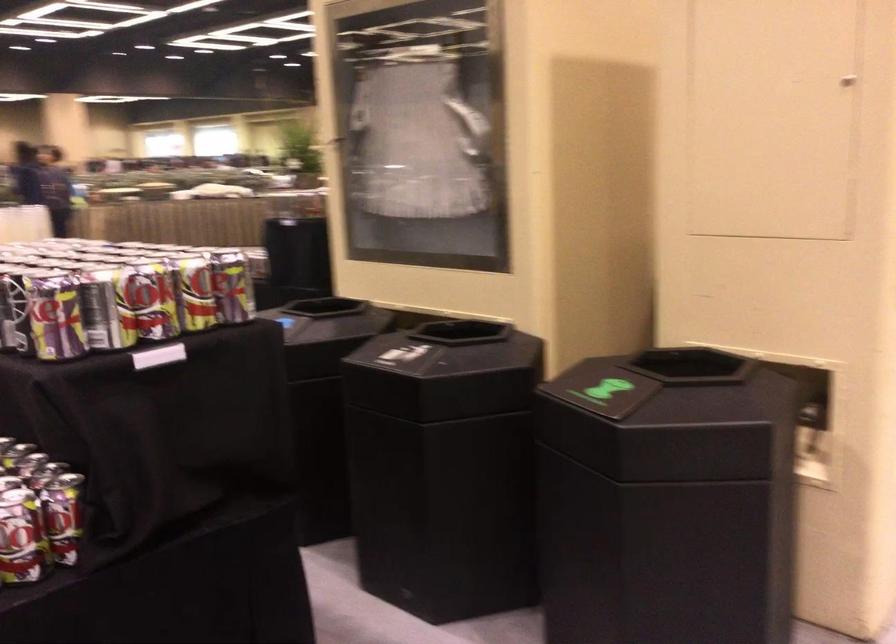
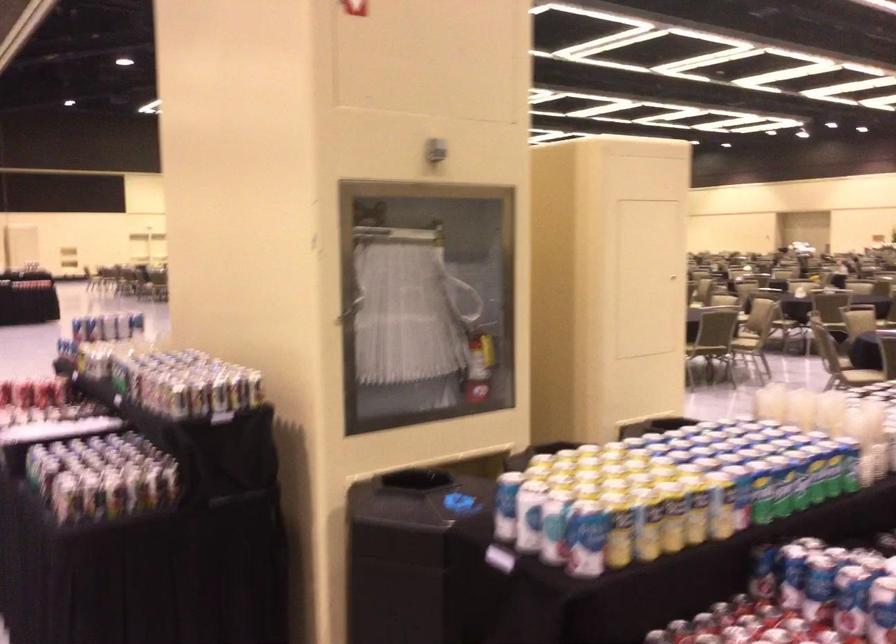
Where in the second image is the point corresponding to point (367, 147) from the first image?

(349, 310)